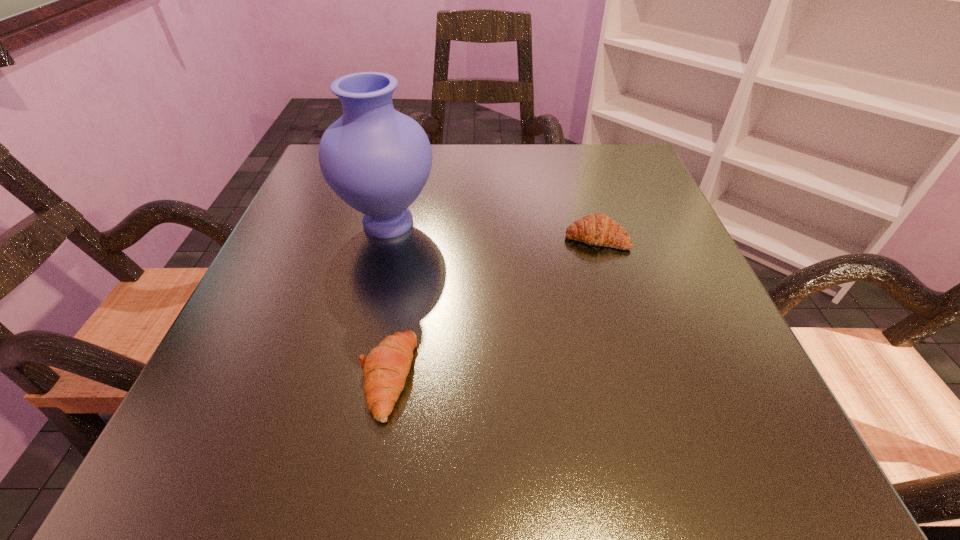
Find the location of a particular element. vase is located at coordinates (377, 160).

You are a GUI agent. You are given a task and a screenshot of the screen. Output one action in this format:
    pyautogui.click(x=<x>, y=<y>)
    Task: Click on the right crescent roll
    The height and width of the screenshot is (540, 960).
    Given the screenshot: What is the action you would take?
    pyautogui.click(x=598, y=229)

The image size is (960, 540). In order to click on the rightmost object in this screenshot , I will do `click(598, 229)`.

Identify the location of the left crescent roll. The height and width of the screenshot is (540, 960). (385, 369).

The width and height of the screenshot is (960, 540). In order to click on the nearest object in this screenshot , I will do `click(385, 369)`.

Identify the location of vacant area located on the front of the tallest object. This screenshot has height=540, width=960. (340, 419).

Image resolution: width=960 pixels, height=540 pixels. Find the location of `free space located on the front of the rightmost object`. free space located on the front of the rightmost object is located at coordinates (612, 293).

Locate an element on the screen. This screenshot has height=540, width=960. vacant space located 0.100m on the right of the left crescent roll is located at coordinates [489, 376].

Where is `object at the far edge`? object at the far edge is located at coordinates click(x=377, y=160).

Find the location of a particular element. The height and width of the screenshot is (540, 960). object at the near edge is located at coordinates (385, 369).